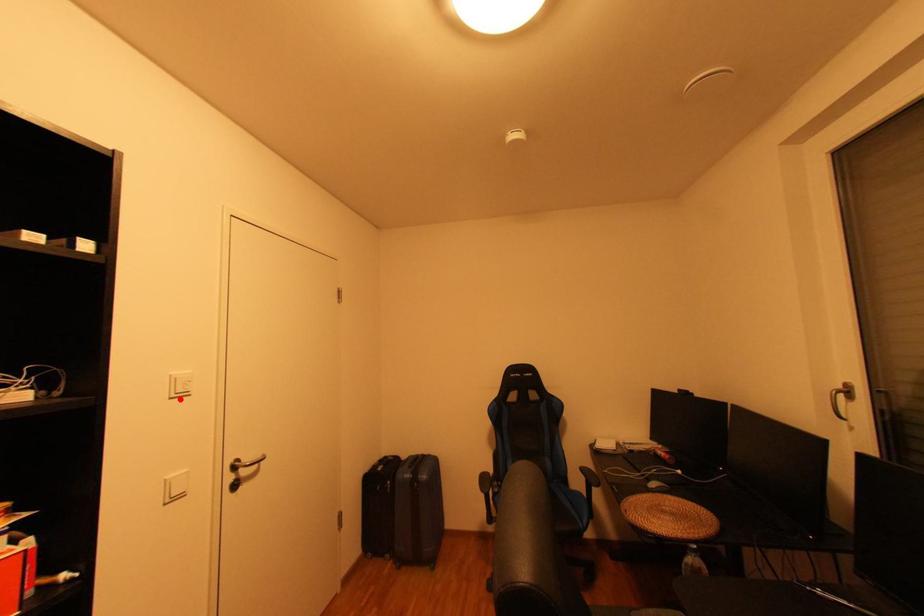
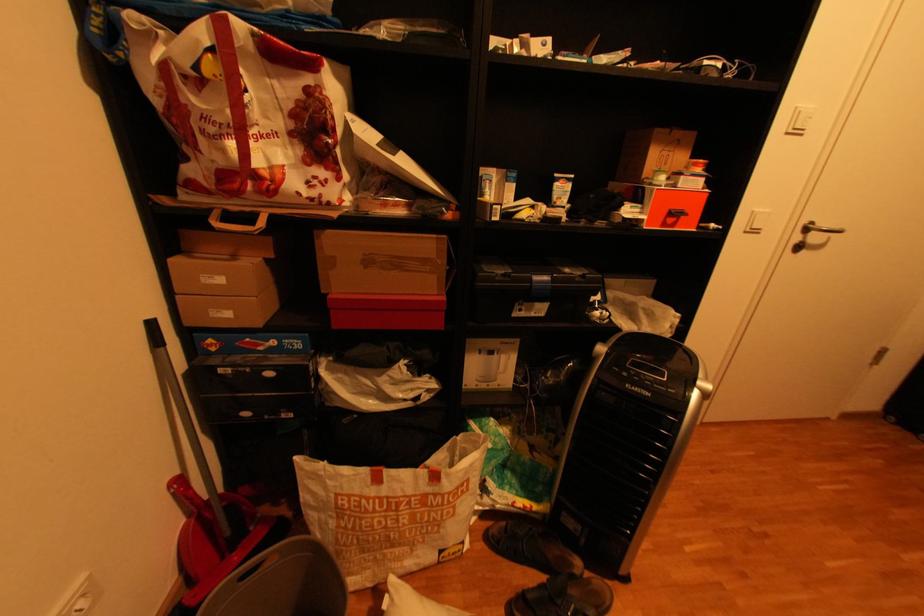
Find the pixel in the second image that matches the highlighted location in the first image.

(796, 134)